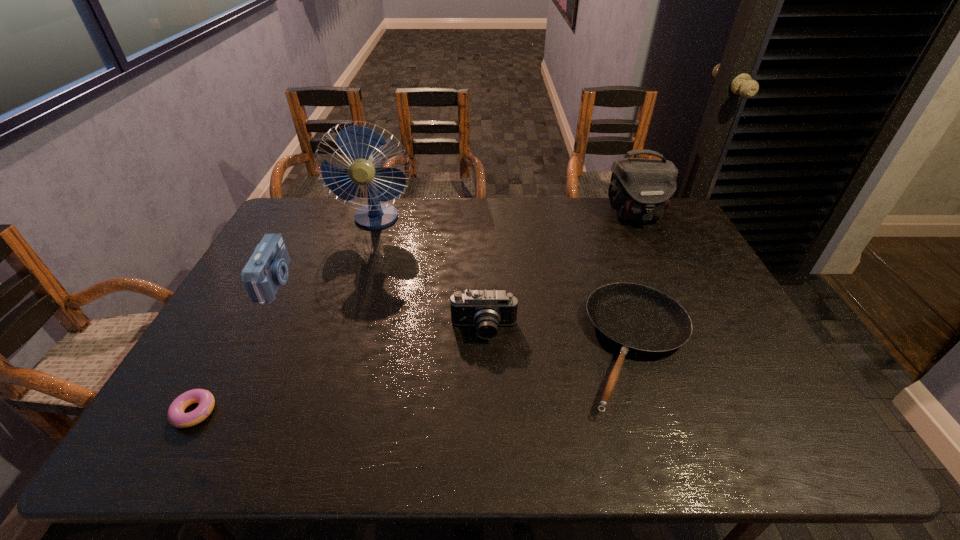
Identify the location of shoulder bag that is at the right edge. The width and height of the screenshot is (960, 540). (641, 189).

Image resolution: width=960 pixels, height=540 pixels. Identify the location of frying pan that is positioned at the right edge. (639, 319).

The image size is (960, 540). Identify the location of object located in the near left corner section of the desktop. (175, 414).

Where is `object present at the far right corner`? This screenshot has height=540, width=960. object present at the far right corner is located at coordinates (641, 189).

Where is `object that is positioned at the near right corner`? The height and width of the screenshot is (540, 960). object that is positioned at the near right corner is located at coordinates (639, 319).

Image resolution: width=960 pixels, height=540 pixels. I want to click on blank space at the far edge, so click(420, 206).

Where is `free spot at the near edge of the desktop`? This screenshot has width=960, height=540. free spot at the near edge of the desktop is located at coordinates (636, 434).

The width and height of the screenshot is (960, 540). I want to click on vacant space at the left edge, so click(252, 304).

Identify the location of free region at the far left corner of the desktop. (312, 204).

The width and height of the screenshot is (960, 540). I want to click on vacant region at the near right corner of the desktop, so 758,422.